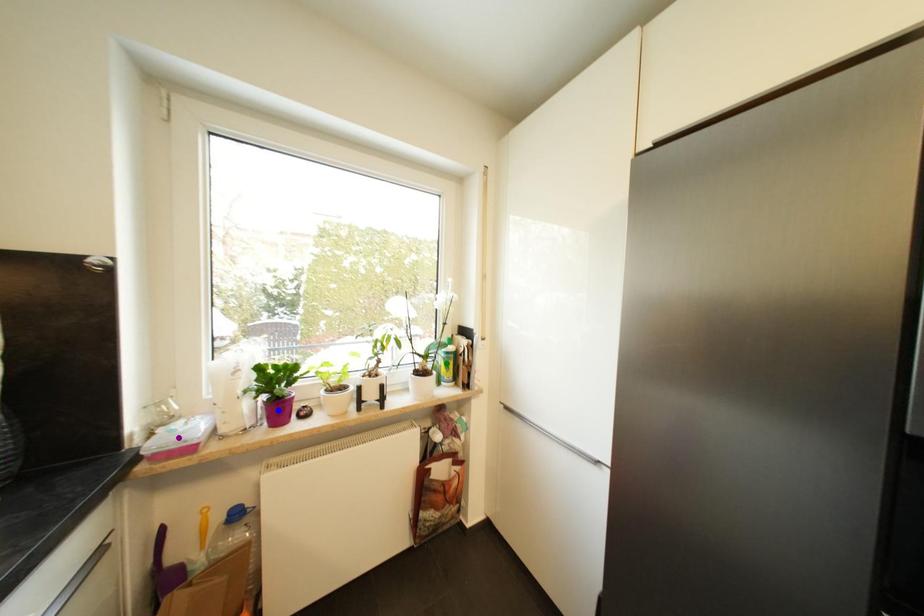
Order these from nearest to farthest:
- purple point
- green point
- blue point

green point < blue point < purple point